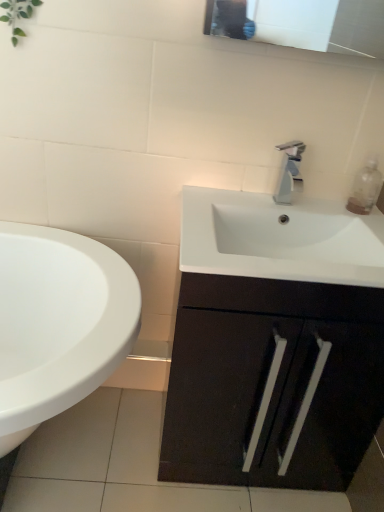
The width and height of the screenshot is (384, 512). I want to click on free space to the left of clear plastic bottle at upper right, so click(314, 208).